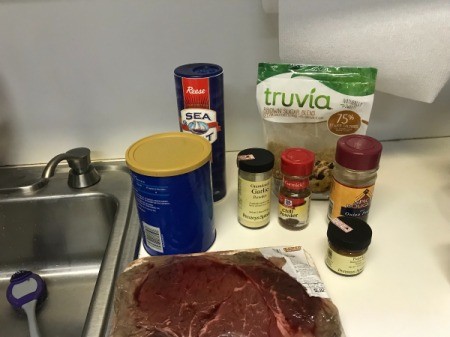
You are a GUI agent. You are given a task and a screenshot of the screen. Output one action in this format:
    pyautogui.click(x=<x>, y=<y>)
    Task: Click on the cream colored countertop
    This screenshot has width=450, height=337.
    Given the screenshot: What is the action you would take?
    pyautogui.click(x=403, y=276)